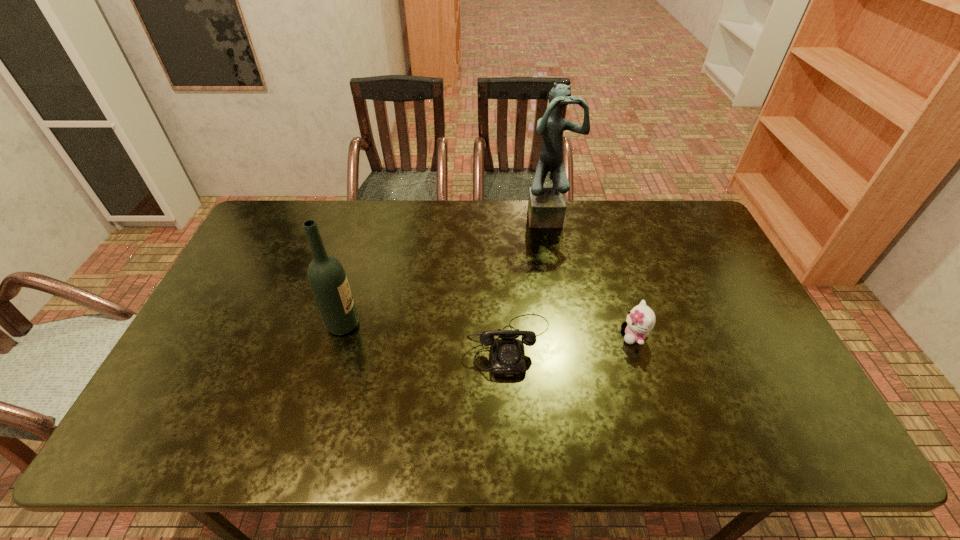
The image size is (960, 540). In order to click on the farthest object in this screenshot , I will do `click(546, 206)`.

At what (x,y) coordinates should I click in order to perform the action: click on sculpture. Please return your answer as a coordinate pair (x, y). The height and width of the screenshot is (540, 960). Looking at the image, I should click on (546, 206).

You are a GUI agent. You are given a task and a screenshot of the screen. Output one action in this format:
    pyautogui.click(x=<x>, y=<y>)
    Task: Click on the second tallest object
    This screenshot has width=960, height=540.
    Given the screenshot: What is the action you would take?
    pyautogui.click(x=327, y=278)

Where is `the leftmost object`? The height and width of the screenshot is (540, 960). the leftmost object is located at coordinates (327, 278).

You are a GUI agent. You are given a task and a screenshot of the screen. Output one action in this format:
    pyautogui.click(x=<x>, y=<y>)
    Task: Click on the second shortest object
    
    Given the screenshot: What is the action you would take?
    pyautogui.click(x=641, y=319)

You are a GUI agent. You are given a task and a screenshot of the screen. Output one action in this format:
    pyautogui.click(x=<x>, y=<y>)
    Task: Click on the rightmost object
    This screenshot has height=540, width=960.
    Given the screenshot: What is the action you would take?
    (641, 319)

At what (x,y) coordinates should I click in order to perform the action: click on telephone. Please return your answer as a coordinate pair (x, y). Image resolution: width=960 pixels, height=540 pixels. Looking at the image, I should click on (507, 353).

Where is `free spot located on the face of the sculpture`? This screenshot has width=960, height=540. free spot located on the face of the sculpture is located at coordinates (563, 292).

I want to click on vacant space located on the labeled side of the second tallest object, so point(423,325).

Locate an element on the screen. This screenshot has height=540, width=960. free region located on the front-facing side of the third tallest object is located at coordinates (577, 336).